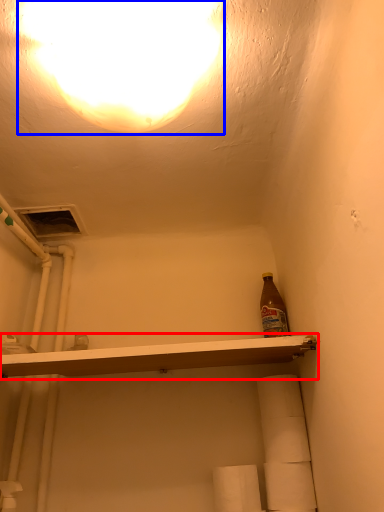
Question: Which object appears closest to the camera in this image, shelf (highlighted by a red box) or light (highlighted by a blue box)?

Choices:
 (A) shelf
 (B) light

Answer: (B)